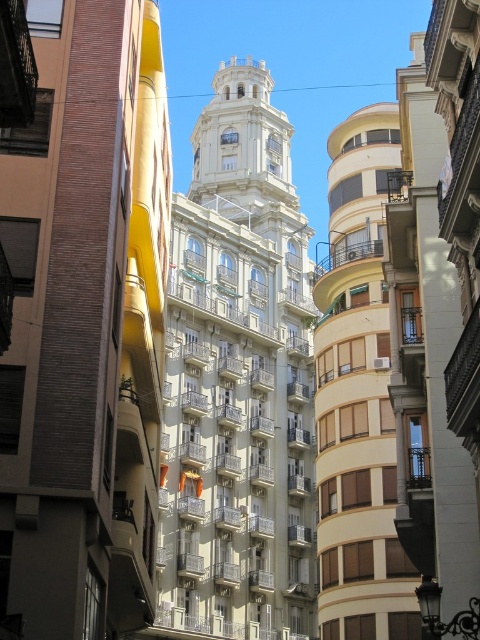
Can you confirm if white textured building at center is smaller than smooth beige balcony at right?

No, white textured building at center is not smaller than smooth beige balcony at right.

Who is more distant from viewer, (296, 589) or (403, 320)?

The point (296, 589) is behind.

Locate an element on the screen. white textured building at center is located at coordinates (238, 381).

Locate an element on the screen. This screenshot has width=480, height=640. beige textured building at center is located at coordinates (358, 396).

Which is above, beige textured building at center or smooth beige balcony at right?

beige textured building at center is higher up.

Between point (365, 173) and point (395, 243), which one is positioned in front?

Point (395, 243) is more forward.

Find the location of a particular element. The width and height of the screenshot is (480, 640). beige textured building at center is located at coordinates (358, 396).

Is white textured building at center taller than beige textured building at center?

Yes, white textured building at center is taller than beige textured building at center.

Does white textured building at center have a lesser width compared to beige textured building at center?

In fact, white textured building at center might be wider than beige textured building at center.

What do you see at coordinates (238, 381) in the screenshot?
I see `white textured building at center` at bounding box center [238, 381].

Locate an element on the screen. white textured building at center is located at coordinates (238, 381).